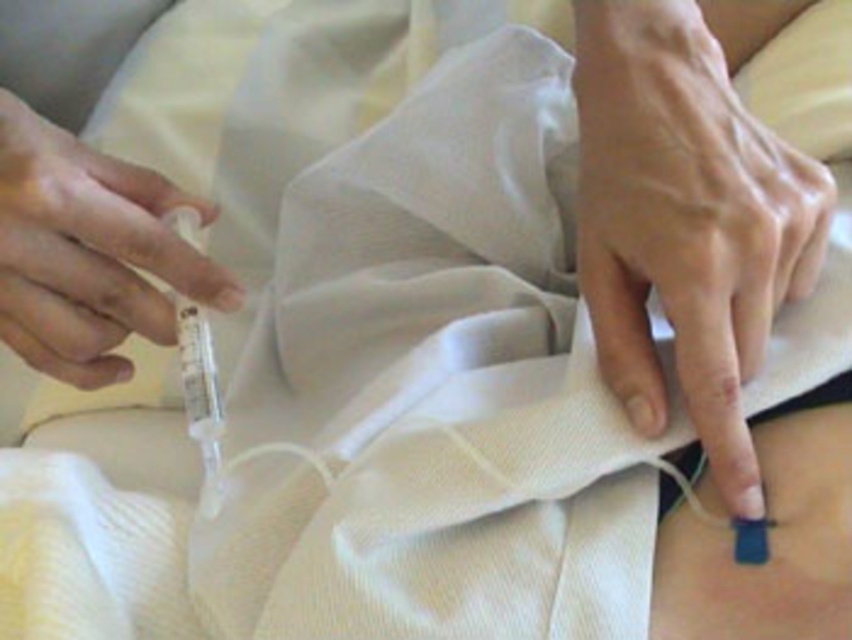
Question: Among these objects, which one is farthest from the camera?

Choices:
 (A) transparent plastic syringe at left
 (B) blue matte sensor at lower right
 (C) smooth skin at lower right

Answer: (A)

Question: Does smooth skin at lower right have a greater width compared to transparent plastic syringe at left?

Choices:
 (A) no
 (B) yes

Answer: (B)

Question: Does transparent plastic syringe at left come behind blue matte sensor at lower right?

Choices:
 (A) no
 (B) yes

Answer: (B)

Question: Observing the image, what is the correct spatial positioning of smooth skin at lower right in reference to transparent plastic syringe at left?

Choices:
 (A) right
 (B) left

Answer: (A)

Question: Which object appears farthest from the camera in this image?

Choices:
 (A) transparent plastic syringe at left
 (B) smooth skin at lower right

Answer: (A)

Question: Which point is farther from the camera taking this photo?

Choices:
 (A) (701, 602)
 (B) (639, 369)
 (C) (153, 195)

Answer: (C)